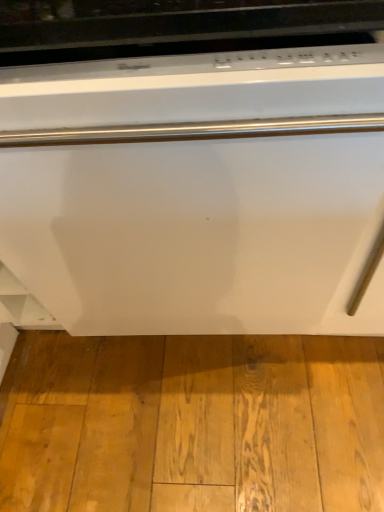
Question: In terms of height, does light brown wood flooring at lower center look taller or shorter compared to white glossy dishwasher at center?

Choices:
 (A) tall
 (B) short

Answer: (B)

Question: Would you say light brown wood flooring at lower center is to the left or to the right of white glossy dishwasher at center in the picture?

Choices:
 (A) left
 (B) right

Answer: (B)

Question: Looking at the image, does light brown wood flooring at lower center seem bigger or smaller compared to white glossy dishwasher at center?

Choices:
 (A) big
 (B) small

Answer: (B)

Question: Considering the positions of point (114, 148) and point (152, 476), is point (114, 148) closer or farther from the camera than point (152, 476)?

Choices:
 (A) closer
 (B) farther

Answer: (A)

Question: Considering the positions of white glossy dishwasher at center and light brown wood flooring at lower center in the image, is white glossy dishwasher at center taller or shorter than light brown wood flooring at lower center?

Choices:
 (A) tall
 (B) short

Answer: (A)

Question: Would you say white glossy dishwasher at center is inside or outside light brown wood flooring at lower center?

Choices:
 (A) inside
 (B) outside

Answer: (B)

Question: Would you say white glossy dishwasher at center is to the left or to the right of light brown wood flooring at lower center in the picture?

Choices:
 (A) right
 (B) left

Answer: (B)